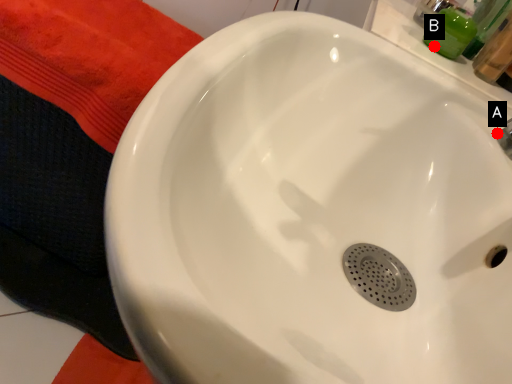
Question: Two points are circled on the image, labeled by A and B beside each circle. Which point appears farthest from the camera in this image?

Choices:
 (A) A is further
 (B) B is further

Answer: (B)